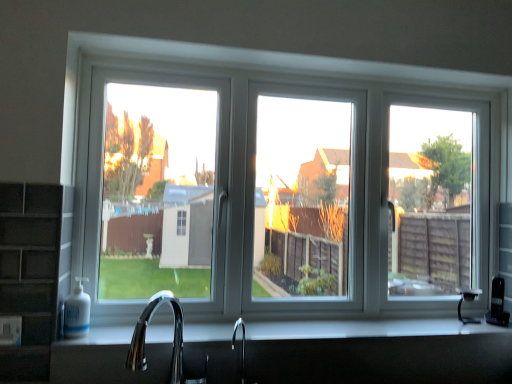
This screenshot has width=512, height=384. I want to click on free point above white plastic window at center (from a real-world perspective), so click(292, 69).